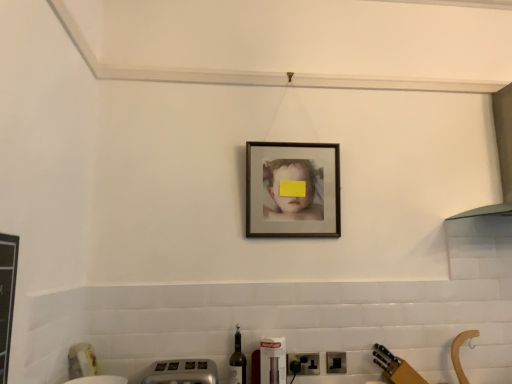
Question: Would you say metallic silver toaster at lower center is a long distance from translucent glass wine bottle at lower center?

Choices:
 (A) yes
 (B) no

Answer: (B)

Question: Can you confirm if metallic silver toaster at lower center is bigger than translucent glass wine bottle at lower center?

Choices:
 (A) no
 (B) yes

Answer: (B)

Question: Considering the relative sizes of metallic silver toaster at lower center and translucent glass wine bottle at lower center in the image provided, is metallic silver toaster at lower center thinner than translucent glass wine bottle at lower center?

Choices:
 (A) no
 (B) yes

Answer: (A)

Question: From the image's perspective, would you say metallic silver toaster at lower center is positioned over translucent glass wine bottle at lower center?

Choices:
 (A) no
 (B) yes

Answer: (B)

Question: Is metallic silver toaster at lower center at the right side of translucent glass wine bottle at lower center?

Choices:
 (A) yes
 (B) no

Answer: (B)

Question: From the image's perspective, is matte wooden picture frame at center located above or below white glossy exhaust hood at upper right?

Choices:
 (A) below
 (B) above

Answer: (A)

Question: Is matte wooden picture frame at center situated inside white glossy exhaust hood at upper right or outside?

Choices:
 (A) inside
 (B) outside

Answer: (B)

Question: From a real-world perspective, is matte wooden picture frame at center physically located above or below white glossy exhaust hood at upper right?

Choices:
 (A) below
 (B) above

Answer: (A)

Question: Is matte wooden picture frame at center taller or shorter than white glossy exhaust hood at upper right?

Choices:
 (A) tall
 (B) short

Answer: (B)

Question: Considering the positions of black plastic electric outlet at lower center, arranged as the first electric outlet when viewed from the left, and black plastic electric outlet at lower center, placed as the second electric outlet when sorted from left to right, in the image, is black plastic electric outlet at lower center, arranged as the first electric outlet when viewed from the left, taller or shorter than black plastic electric outlet at lower center, placed as the second electric outlet when sorted from left to right,?

Choices:
 (A) short
 (B) tall

Answer: (B)

Question: In the image, is black plastic electric outlet at lower center, which appears as the second electric outlet when viewed from the right, on the left side or the right side of black plastic electric outlet at lower center, positioned as the 1th electric outlet in right-to-left order?

Choices:
 (A) right
 (B) left

Answer: (B)

Question: From the image's perspective, is black plastic electric outlet at lower center, arranged as the first electric outlet when viewed from the left, above or below black plastic electric outlet at lower center, positioned as the 1th electric outlet in right-to-left order?

Choices:
 (A) below
 (B) above

Answer: (A)

Question: Which is correct: black plastic electric outlet at lower center, arranged as the first electric outlet when viewed from the left, is inside black plastic electric outlet at lower center, positioned as the 1th electric outlet in right-to-left order, or outside of it?

Choices:
 (A) inside
 (B) outside

Answer: (B)

Question: From a real-world perspective, is translucent glass wine bottle at lower center physically located above or below black plastic electric outlet at lower center, placed as the second electric outlet when sorted from left to right?

Choices:
 (A) below
 (B) above

Answer: (A)

Question: From their relative heights in the image, would you say translucent glass wine bottle at lower center is taller or shorter than black plastic electric outlet at lower center, placed as the second electric outlet when sorted from left to right?

Choices:
 (A) tall
 (B) short

Answer: (A)